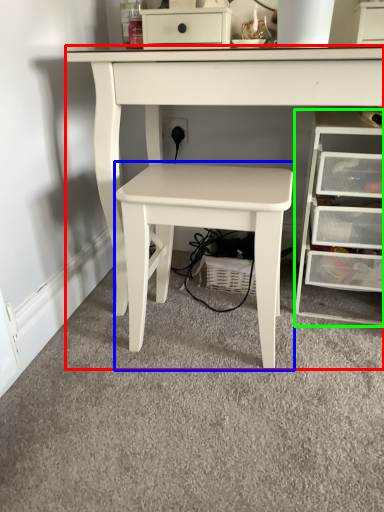
Question: Which object is the farthest from table (highlighted by a red box)? Choose among these: table (highlighted by a blue box) or chest of drawers (highlighted by a green box).

Choices:
 (A) table
 (B) chest of drawers

Answer: (B)